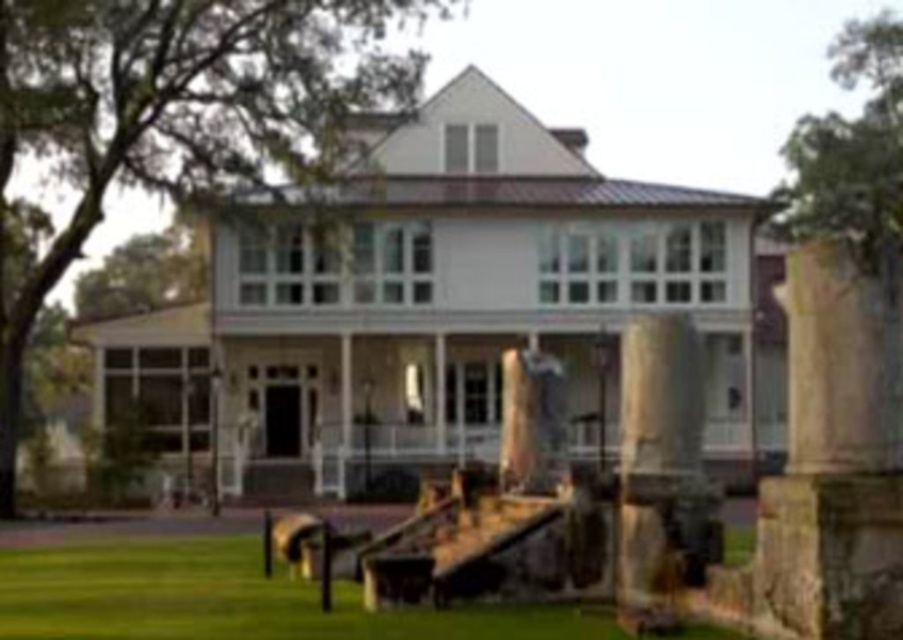
Question: Does beige stone column at right have a greater width compared to brown stone pillar at center?

Choices:
 (A) yes
 (B) no

Answer: (A)

Question: Considering the real-world distances, which object is farthest from the brown stone pillar at center?

Choices:
 (A) green grass at lower left
 (B) beige stone column at right

Answer: (A)

Question: Which point is closer to the camera taking this photo?

Choices:
 (A) (641, 509)
 (B) (394, 609)

Answer: (B)

Question: Is beige stone column at right closer to camera compared to green grass at lower left?

Choices:
 (A) no
 (B) yes

Answer: (B)

Question: Does beige stone column at right have a lesser width compared to green grass at lower left?

Choices:
 (A) yes
 (B) no

Answer: (A)

Question: Which point appears closest to the camera in this image?

Choices:
 (A) (82, 577)
 (B) (849, 573)
 (C) (648, 378)

Answer: (B)